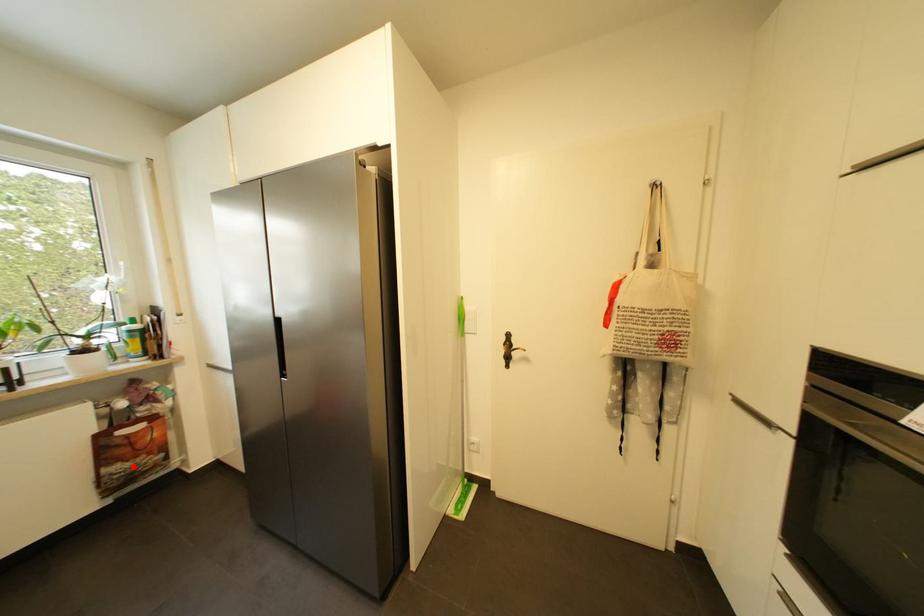
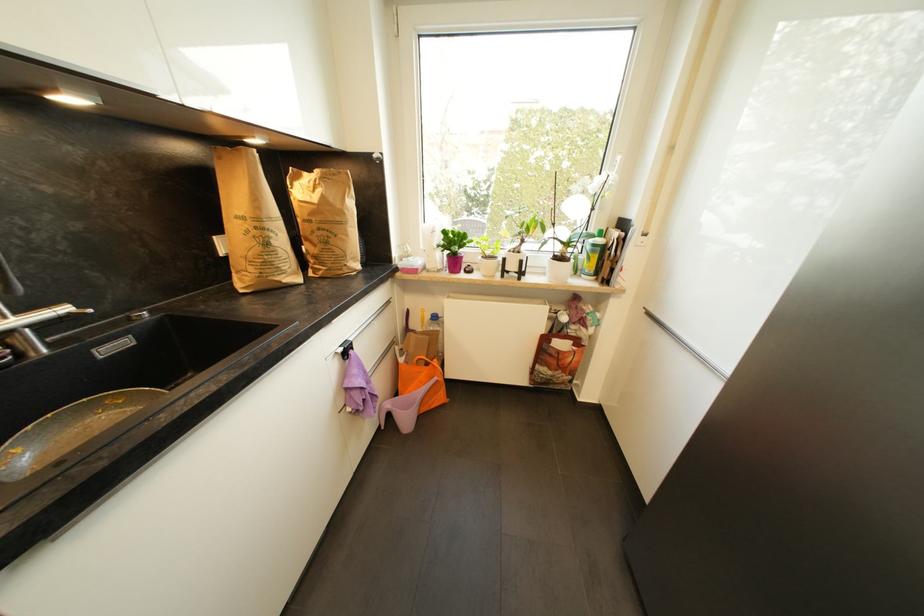
Question: I am providing you with two images of the same scene from different viewpoints. Given a red point in image1, look at the same physical point in image2. Is it:

Choices:
 (A) Closer to the viewpoint
 (B) Farther from the viewpoint

Answer: (B)